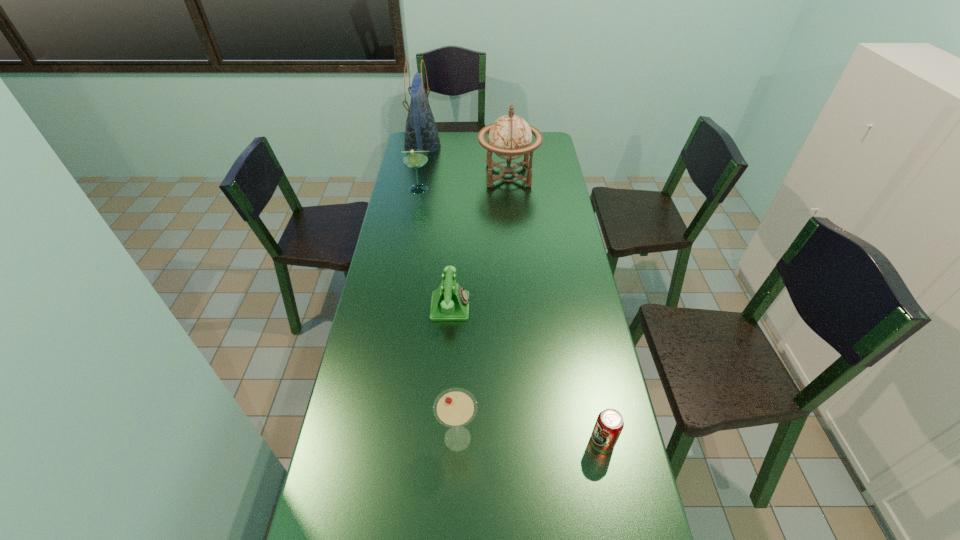
Identify the location of empty space that is in between the rightmost object and the right martini. The image size is (960, 540). (530, 440).

Locate an element on the screen. This screenshot has height=540, width=960. free spot between the nearer martini and the third nearest object is located at coordinates (454, 372).

The image size is (960, 540). Find the location of `vacant region between the farther martini and the soda`. vacant region between the farther martini and the soda is located at coordinates (511, 315).

Identify which object is the second closest to the right martini. Please provide its 2D coordinates. Your answer should be formatted as a tuple, i.e. [(x, y)], where the tuple contains the x and y coordinates of a point satisfying the conditions above.

[(450, 302)]

Identify which object is the closest to the globe. Please provide its 2D coordinates. Your answer should be formatted as a tuple, i.e. [(x, y)], where the tuple contains the x and y coordinates of a point satisfying the conditions above.

[(421, 132)]

This screenshot has height=540, width=960. I want to click on vacant area in the image that satisfies the following two spatial constraints: 1. on the front-facing side of the globe; 2. on the back side of the soda, so click(530, 441).

Where is `free location that satisfies the following two spatial constraints: 1. on the dial of the telephone; 2. on the left side of the nearer martini`? The height and width of the screenshot is (540, 960). free location that satisfies the following two spatial constraints: 1. on the dial of the telephone; 2. on the left side of the nearer martini is located at coordinates (443, 438).

At what (x,y) coordinates should I click in order to perform the action: click on vacant space that satisfies the following two spatial constraints: 1. on the dial of the nearer martini; 2. on the left side of the telephone. Please return your answer as a coordinate pair (x, y). Looking at the image, I should click on (443, 438).

Find the location of a particular element. vacant area that satisfies the following two spatial constraints: 1. on the front-facing side of the second tallest object; 2. on the front side of the farther martini is located at coordinates (510, 189).

Find the location of a particular element. This screenshot has height=540, width=960. free spot that satisfies the following two spatial constraints: 1. on the front side of the right martini; 2. on the right side of the tallest object is located at coordinates (369, 438).